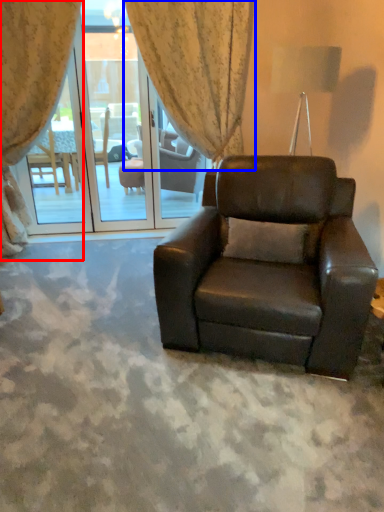
Question: Which of the following is the farthest to the observer, curtain (highlighted by a red box) or curtain (highlighted by a blue box)?

Choices:
 (A) curtain
 (B) curtain

Answer: (B)